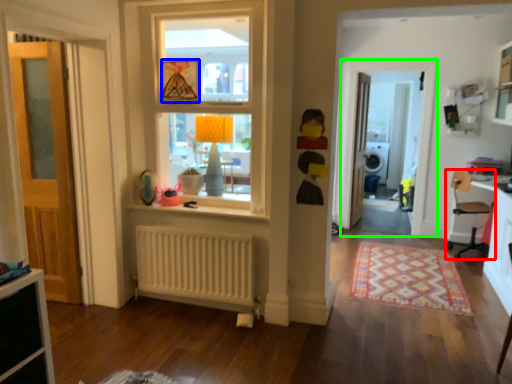
Question: Which is farther away from chair (highlighted by a red box)? picture frame (highlighted by a blue box) or screen door (highlighted by a green box)?

Choices:
 (A) picture frame
 (B) screen door

Answer: (A)